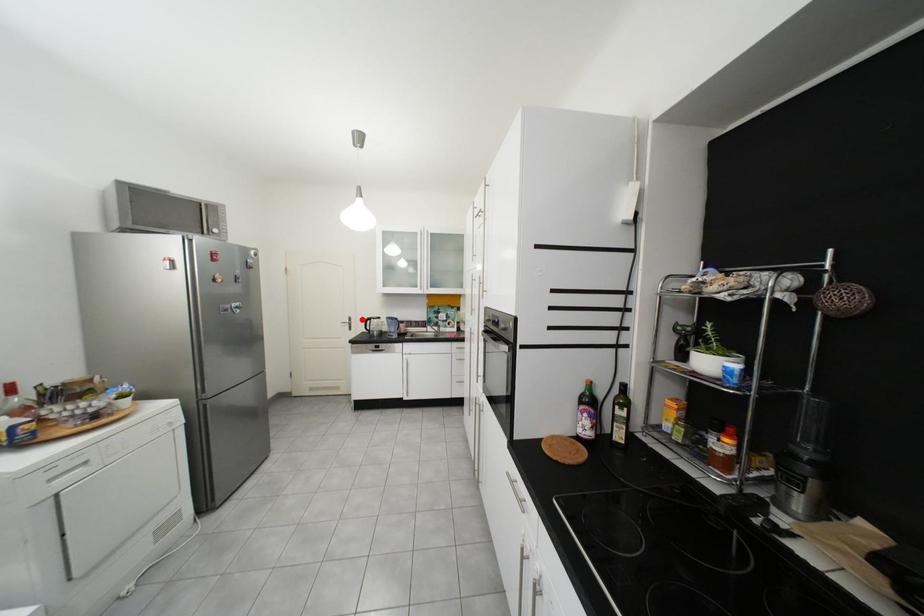
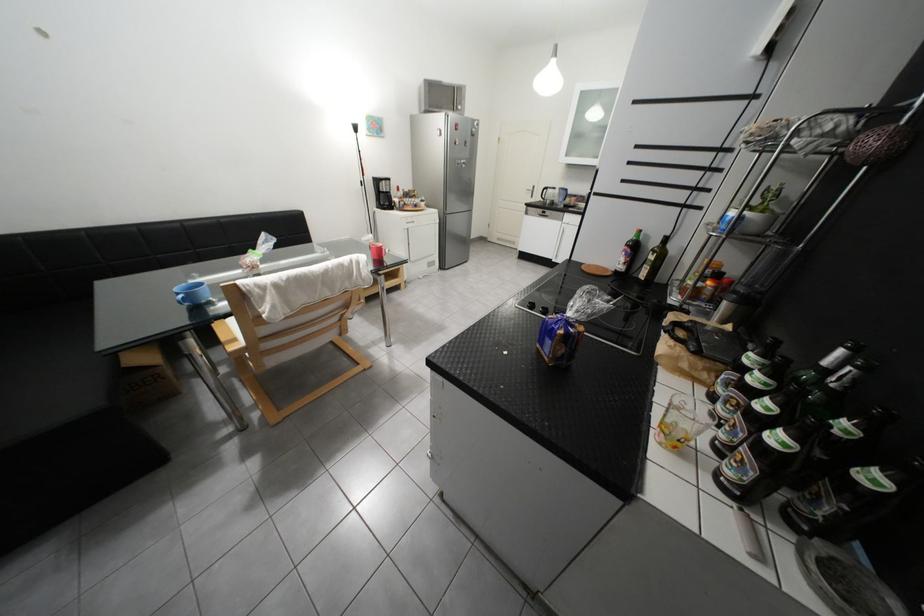
Question: I am providing you with two images of the same scene from different viewpoints. In image1, a red point is highlighted. Considering the same 3D point in image2, which of the following is correct?

Choices:
 (A) It is closer
 (B) It is farther

Answer: (A)